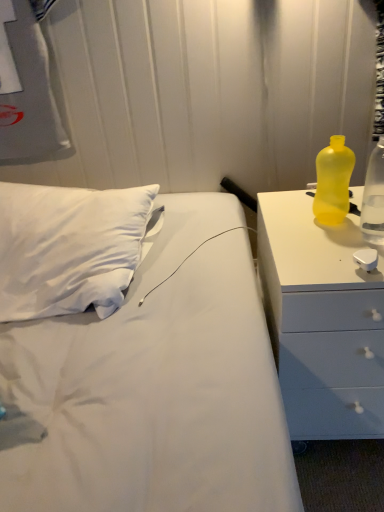
Measure the distance between yellow translucent bottle at right, the first bottle positioned from the right, and camera.

yellow translucent bottle at right, the first bottle positioned from the right, and camera are 35.77 inches apart.

What do you see at coordinates (374, 197) in the screenshot? The image size is (384, 512). I see `yellow translucent bottle at right, the first bottle positioned from the right` at bounding box center [374, 197].

The width and height of the screenshot is (384, 512). Describe the element at coordinates (333, 182) in the screenshot. I see `yellow translucent bottle at right, which ranks as the first bottle in left-to-right order` at that location.

I want to click on yellow translucent bottle at right, which ranks as the first bottle in left-to-right order, so click(333, 182).

Describe the element at coordinates (322, 320) in the screenshot. The width and height of the screenshot is (384, 512). I see `yellow plastic bottle at right` at that location.

At what (x,y) coordinates should I click in order to perform the action: click on yellow translucent bottle at right, the 2th bottle viewed from the left. Please return your answer as a coordinate pair (x, y). Looking at the image, I should click on (374, 197).

Which of these two, yellow plastic bottle at right or yellow translucent bottle at right, which ranks as the first bottle in left-to-right order, stands taller?

Standing taller between the two is yellow plastic bottle at right.

From the image's perspective, is yellow plastic bottle at right on top of yellow translucent bottle at right, which ranks as the first bottle in left-to-right order?

Actually, yellow plastic bottle at right appears below yellow translucent bottle at right, which ranks as the first bottle in left-to-right order, in the image.

Is yellow plastic bottle at right not close to yellow translucent bottle at right, positioned as the 2th bottle in right-to-left order?

No.

Is yellow plastic bottle at right to the right of yellow translucent bottle at right, which ranks as the first bottle in left-to-right order, from the viewer's perspective?

Indeed, yellow plastic bottle at right is positioned on the right side of yellow translucent bottle at right, which ranks as the first bottle in left-to-right order.

Can you tell me how much yellow plastic bottle at right and yellow translucent bottle at right, the first bottle positioned from the right, differ in facing direction?

The facing directions of yellow plastic bottle at right and yellow translucent bottle at right, the first bottle positioned from the right, are 0.00152 degrees apart.

From the picture: Is yellow plastic bottle at right bigger or smaller than yellow translucent bottle at right, the first bottle positioned from the right?

Clearly, yellow plastic bottle at right is larger in size than yellow translucent bottle at right, the first bottle positioned from the right.

From the image's perspective, is yellow plastic bottle at right located above or below yellow translucent bottle at right, the 2th bottle viewed from the left?

yellow plastic bottle at right is situated lower than yellow translucent bottle at right, the 2th bottle viewed from the left, in the image.

From the image's perspective, who appears lower, yellow translucent bottle at right, positioned as the 2th bottle in right-to-left order, or yellow translucent bottle at right, the first bottle positioned from the right?

From the image's view, yellow translucent bottle at right, the first bottle positioned from the right, is below.

Relative to yellow translucent bottle at right, the first bottle positioned from the right, is yellow translucent bottle at right, positioned as the 2th bottle in right-to-left order, in front or behind?

Visually, yellow translucent bottle at right, positioned as the 2th bottle in right-to-left order, is located behind yellow translucent bottle at right, the first bottle positioned from the right.

Is yellow translucent bottle at right, positioned as the 2th bottle in right-to-left order, to the right of yellow translucent bottle at right, the first bottle positioned from the right, from the viewer's perspective?

No, yellow translucent bottle at right, positioned as the 2th bottle in right-to-left order, is not to the right of yellow translucent bottle at right, the first bottle positioned from the right.

From the picture: Measure the distance between yellow translucent bottle at right, positioned as the 2th bottle in right-to-left order, and yellow translucent bottle at right, the 2th bottle viewed from the left.

They are 16.28 centimeters apart.

Can you confirm if yellow translucent bottle at right, the first bottle positioned from the right, is smaller than yellow plastic bottle at right?

Yes, yellow translucent bottle at right, the first bottle positioned from the right, is smaller than yellow plastic bottle at right.

Considering the points (369, 192) and (376, 349), which point is in front, point (369, 192) or point (376, 349)?

The point (376, 349) is closer.

Would you say yellow translucent bottle at right, the 2th bottle viewed from the left, contains yellow plastic bottle at right?

Result: Definitely not — yellow plastic bottle at right is not inside yellow translucent bottle at right, the 2th bottle viewed from the left.

From a real-world perspective, does yellow translucent bottle at right, the 2th bottle viewed from the left, sit lower than yellow plastic bottle at right?

No, from a real-world perspective, yellow translucent bottle at right, the 2th bottle viewed from the left, is not beneath yellow plastic bottle at right.

Does yellow translucent bottle at right, positioned as the 2th bottle in right-to-left order, have a lesser width compared to yellow plastic bottle at right?

Yes, yellow translucent bottle at right, positioned as the 2th bottle in right-to-left order, is thinner than yellow plastic bottle at right.

In terms of size, does yellow translucent bottle at right, which ranks as the first bottle in left-to-right order, appear bigger or smaller than yellow plastic bottle at right?

yellow translucent bottle at right, which ranks as the first bottle in left-to-right order, is smaller than yellow plastic bottle at right.

From the image's perspective, relative to yellow plastic bottle at right, is yellow translucent bottle at right, positioned as the 2th bottle in right-to-left order, above or below?

yellow translucent bottle at right, positioned as the 2th bottle in right-to-left order, is above yellow plastic bottle at right.

What's the angular difference between yellow translucent bottle at right, positioned as the 2th bottle in right-to-left order, and yellow plastic bottle at right's facing directions?

0.00091 degrees separate the facing orientations of yellow translucent bottle at right, positioned as the 2th bottle in right-to-left order, and yellow plastic bottle at right.

Where is `bottle above the yellow translucent bottle at right, the 2th bottle viewed from the left (from the image's perspective)`? bottle above the yellow translucent bottle at right, the 2th bottle viewed from the left (from the image's perspective) is located at coordinates (333, 182).

Is the position of yellow translucent bottle at right, the 2th bottle viewed from the left, more distant than that of yellow translucent bottle at right, positioned as the 2th bottle in right-to-left order?

No, it is in front of yellow translucent bottle at right, positioned as the 2th bottle in right-to-left order.

Can you confirm if yellow translucent bottle at right, the first bottle positioned from the right, is positioned to the right of yellow translucent bottle at right, positioned as the 2th bottle in right-to-left order?

Yes.

Considering the positions of point (379, 209) and point (348, 176), is point (379, 209) closer or farther from the camera than point (348, 176)?

Point (379, 209).

Find the location of `chest of drawers in front of the yellow translucent bottle at right, positioned as the 2th bottle in right-to-left order`. chest of drawers in front of the yellow translucent bottle at right, positioned as the 2th bottle in right-to-left order is located at coordinates (322, 320).

The height and width of the screenshot is (512, 384). What are the coordinates of `bottle on the right of yellow plastic bottle at right` in the screenshot? It's located at (374, 197).

When comparing their distances from yellow plastic bottle at right, does yellow translucent bottle at right, the first bottle positioned from the right, or yellow translucent bottle at right, which ranks as the first bottle in left-to-right order, seem closer?

The object closer to yellow plastic bottle at right is yellow translucent bottle at right, which ranks as the first bottle in left-to-right order.

Which object lies nearer to the anchor point yellow translucent bottle at right, positioned as the 2th bottle in right-to-left order, yellow plastic bottle at right or yellow translucent bottle at right, the first bottle positioned from the right?

Among the two, yellow translucent bottle at right, the first bottle positioned from the right, is located nearer to yellow translucent bottle at right, positioned as the 2th bottle in right-to-left order.

Based on the photo, from the image, which object appears to be farther from yellow translucent bottle at right, the 2th bottle viewed from the left, yellow translucent bottle at right, positioned as the 2th bottle in right-to-left order, or yellow plastic bottle at right?

yellow plastic bottle at right is further to yellow translucent bottle at right, the 2th bottle viewed from the left.

Looking at the image, which one is located further to yellow translucent bottle at right, the 2th bottle viewed from the left, yellow plastic bottle at right or yellow translucent bottle at right, which ranks as the first bottle in left-to-right order?

yellow plastic bottle at right lies further to yellow translucent bottle at right, the 2th bottle viewed from the left, than the other object.

From the picture: Considering their positions, is yellow translucent bottle at right, the 2th bottle viewed from the left, positioned further to yellow translucent bottle at right, positioned as the 2th bottle in right-to-left order, than yellow plastic bottle at right?

The object further to yellow translucent bottle at right, positioned as the 2th bottle in right-to-left order, is yellow plastic bottle at right.

Which object lies further to the anchor point yellow plastic bottle at right, yellow translucent bottle at right, positioned as the 2th bottle in right-to-left order, or yellow translucent bottle at right, the 2th bottle viewed from the left?

Among the two, yellow translucent bottle at right, the 2th bottle viewed from the left, is located further to yellow plastic bottle at right.

Locate an element on the screen. bottle between yellow translucent bottle at right, which ranks as the first bottle in left-to-right order, and yellow plastic bottle at right vertically is located at coordinates (374, 197).